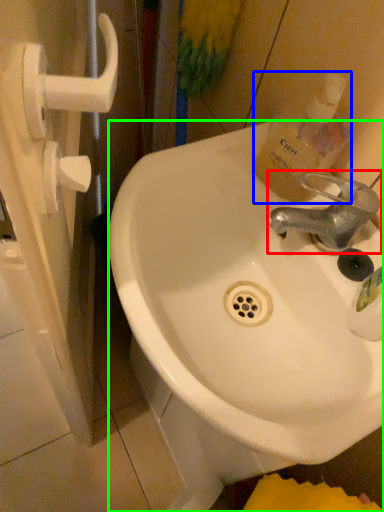
Question: Which is farther away from tap (highlighted by a red box)? bottle (highlighted by a blue box) or sink (highlighted by a green box)?

Choices:
 (A) bottle
 (B) sink

Answer: (B)